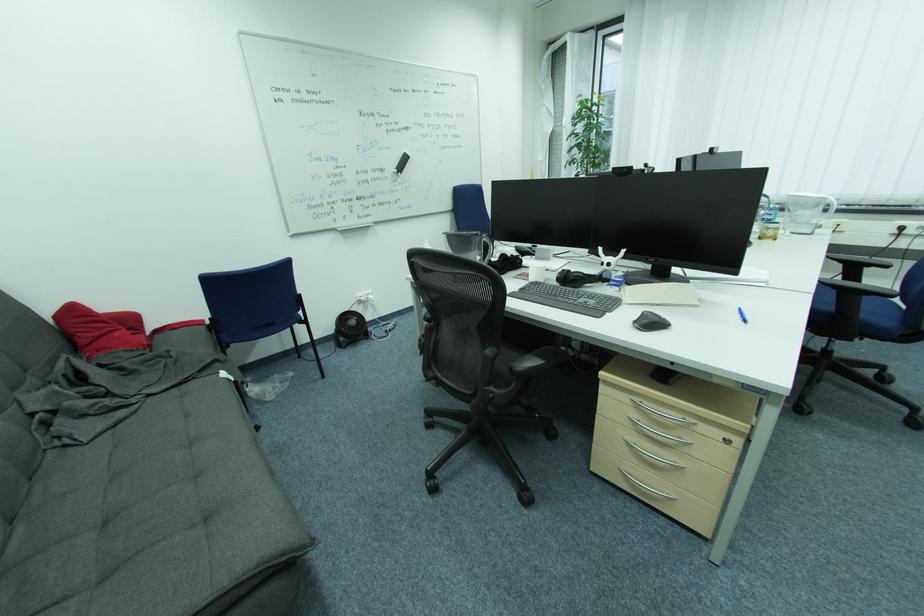
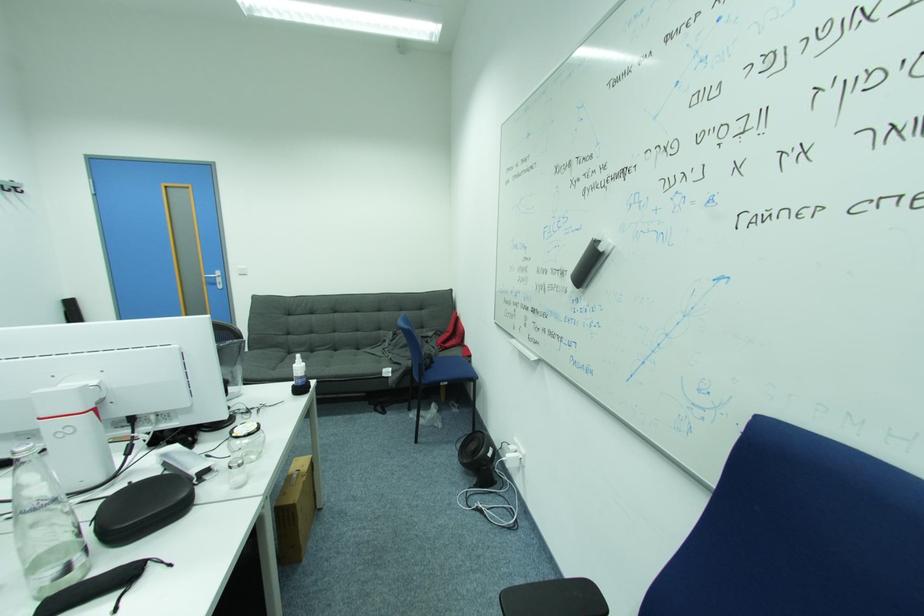
Locate, in the second image, the point that corresponds to (41,428) in the first image.

(388, 341)